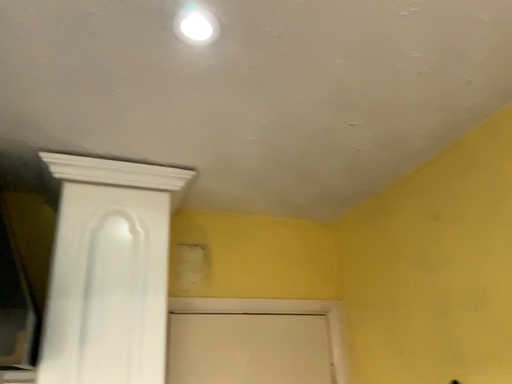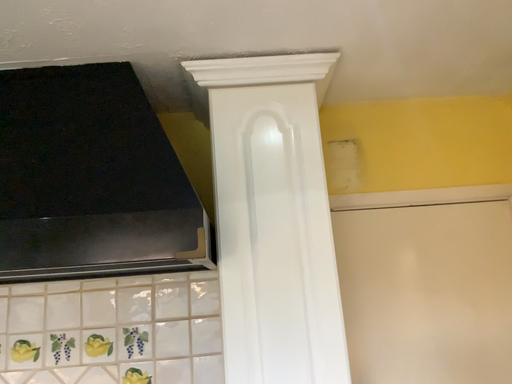
Question: Which way did the camera rotate in the video?

Choices:
 (A) rotated right
 (B) rotated left

Answer: (B)